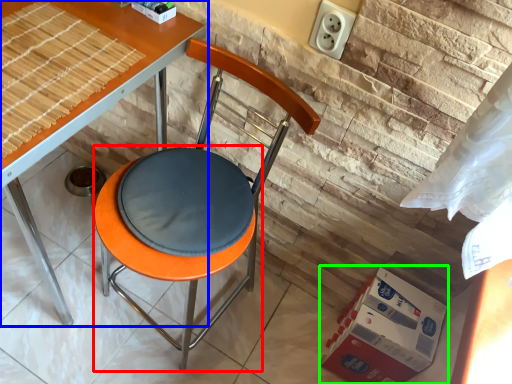
Question: Based on their relative distances, which object is nearer to bar stool (highlighted by a red box)? Choose from table (highlighted by a blue box) and cardboard box (highlighted by a green box).

Choices:
 (A) table
 (B) cardboard box

Answer: (B)